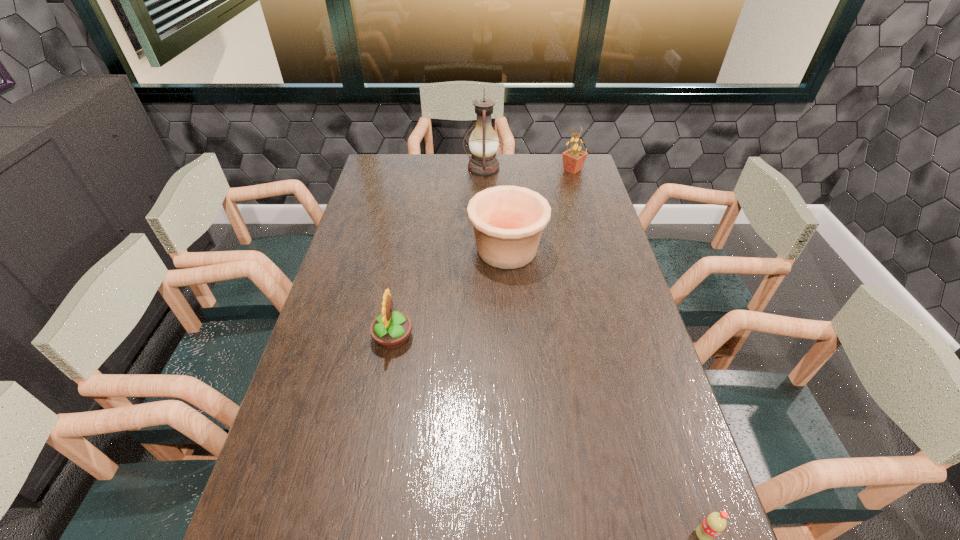
Locate an element on the screen. This screenshot has width=960, height=540. vacant space situated 0.240m on the face of the leftmost object is located at coordinates (499, 338).

Image resolution: width=960 pixels, height=540 pixels. Find the location of `oil lamp that is at the far edge`. oil lamp that is at the far edge is located at coordinates (483, 143).

Locate an element on the screen. sunflower located in the far edge section of the desktop is located at coordinates (573, 159).

Locate an element on the screen. object situated at the right edge is located at coordinates (573, 159).

Where is `object located at the far right corner`? The image size is (960, 540). object located at the far right corner is located at coordinates (573, 159).

This screenshot has width=960, height=540. I want to click on free point at the far edge, so click(x=463, y=158).

Where is `vacant region at the left edge of the desktop`? This screenshot has height=540, width=960. vacant region at the left edge of the desktop is located at coordinates (399, 190).

Where is `vacant region at the right edge of the desktop`? vacant region at the right edge of the desktop is located at coordinates (559, 198).

At what (x,y) coordinates should I click in order to perform the action: click on free space at the far left corner of the desktop. Please return your answer as a coordinate pair (x, y). The width and height of the screenshot is (960, 540). Looking at the image, I should click on (396, 163).

You are a GUI agent. You are given a task and a screenshot of the screen. Output one action in this format:
    pyautogui.click(x=<x>, y=<y>)
    Task: Click on the vacant point located between the right sunflower and the tallest object
    
    Given the screenshot: What is the action you would take?
    pyautogui.click(x=528, y=169)